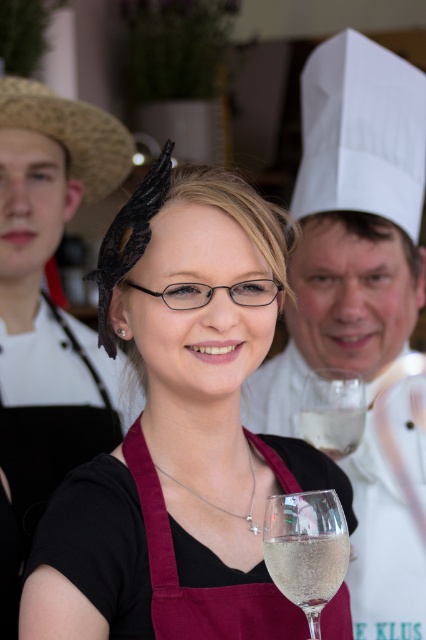
From the picture: You are a photographer setting up for a food photography shoot. You need to ensure that the maroon fabric apron at center and the clear glass wine glass at center are both in focus. Given that the apron is larger than the wine glass, which object should you adjust your camera focus on first to ensure both are sharp?

The maroon fabric apron at center has a larger size compared to the clear glass wine glass at center. To ensure both are in focus, you should focus on the maroon fabric apron at center first since it is larger and requires more precise focus coverage.

You are a guest at a wine tasting event and see the white chef hat at upper center and the clear glass at center. Which object is taller?

The white chef hat at upper center is much taller than the clear glass at center.